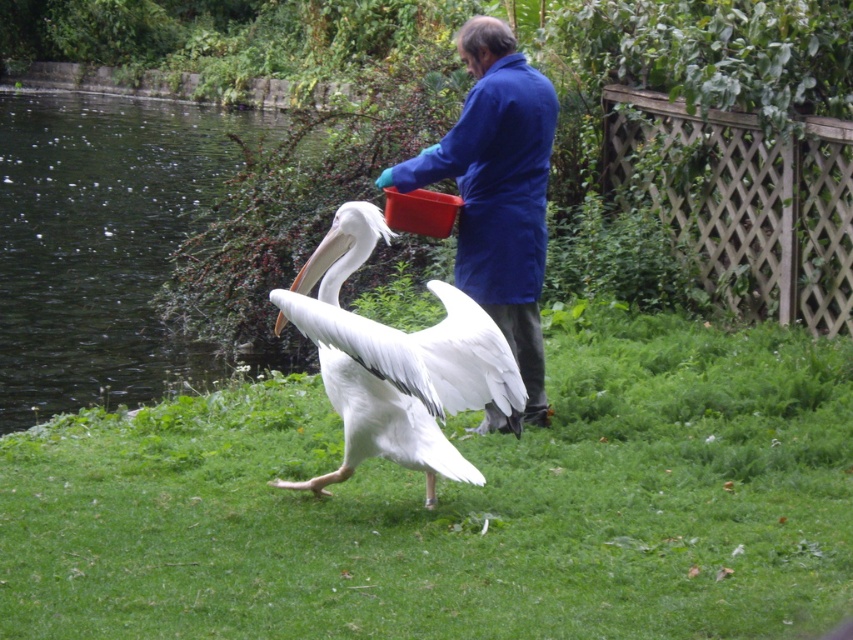
Can you confirm if white matte pelican at center is shorter than blue fabric coat at center?

Indeed, white matte pelican at center has a lesser height compared to blue fabric coat at center.

Measure the distance between point (398, 352) and camera.

They are 20.23 feet apart.

Does point (380, 420) come in front of point (508, 310)?

Yes, point (380, 420) is closer to viewer.

This screenshot has height=640, width=853. Identify the location of white matte pelican at center. (395, 362).

Where is `green grass at center`? green grass at center is located at coordinates (456, 506).

From the picture: Which is below, green grass at center or blue fabric coat at center?

Positioned lower is green grass at center.

Is point (706, 557) positioned behind point (439, 141)?

That is False.

The width and height of the screenshot is (853, 640). In order to click on green grass at center in this screenshot , I will do `click(456, 506)`.

Does green grass at center have a greater height compared to white matte pelican at center?

Incorrect, green grass at center's height is not larger of white matte pelican at center's.

Can you confirm if green grass at center is positioned below white matte pelican at center?

Yes.

This screenshot has height=640, width=853. What do you see at coordinates (456, 506) in the screenshot?
I see `green grass at center` at bounding box center [456, 506].

Identify the location of green grass at center. (456, 506).